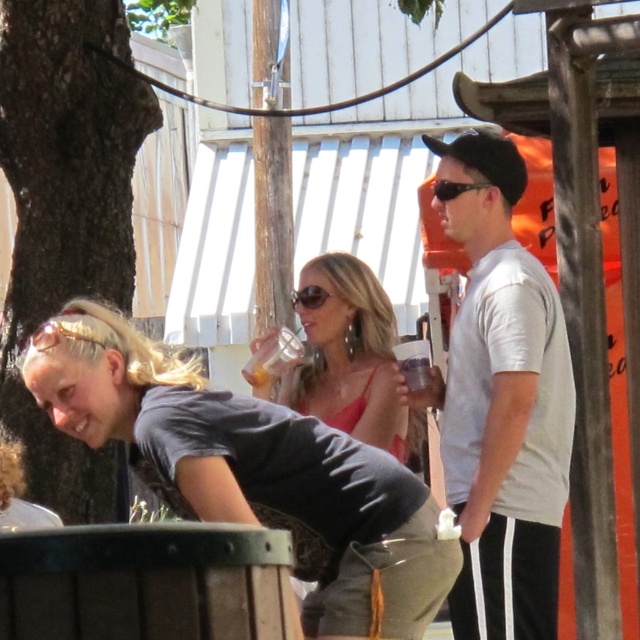
Is brown rough bark tree at left below black plastic sunglasses at upper center?

Indeed, brown rough bark tree at left is positioned under black plastic sunglasses at upper center.

Does brown rough bark tree at left have a lesser height compared to black plastic sunglasses at upper center?

Incorrect, brown rough bark tree at left's height does not fall short of black plastic sunglasses at upper center's.

Is point (12, 426) farther from viewer compared to point (448, 193)?

Yes, it is.

Identify the location of brown rough bark tree at left. (67, 209).

Who is higher up, matte gray shirt at lower left or brown rough bark tree at left?

brown rough bark tree at left is above.

Can you confirm if matte gray shirt at lower left is positioned below brown rough bark tree at left?

Yes.

Identify the location of matte gray shirt at lower left. (253, 472).

Locate an element on the screen. matte gray shirt at lower left is located at coordinates (253, 472).

Which is below, matte gray shirt at lower left or sunglasses at center?

matte gray shirt at lower left

Does matte gray shirt at lower left have a smaller size compared to sunglasses at center?

Incorrect, matte gray shirt at lower left is not smaller in size than sunglasses at center.

Who is more forward, (248,452) or (312,291)?

Positioned in front is point (248,452).

Where is `matte gray shirt at lower left`? This screenshot has width=640, height=640. matte gray shirt at lower left is located at coordinates (253, 472).